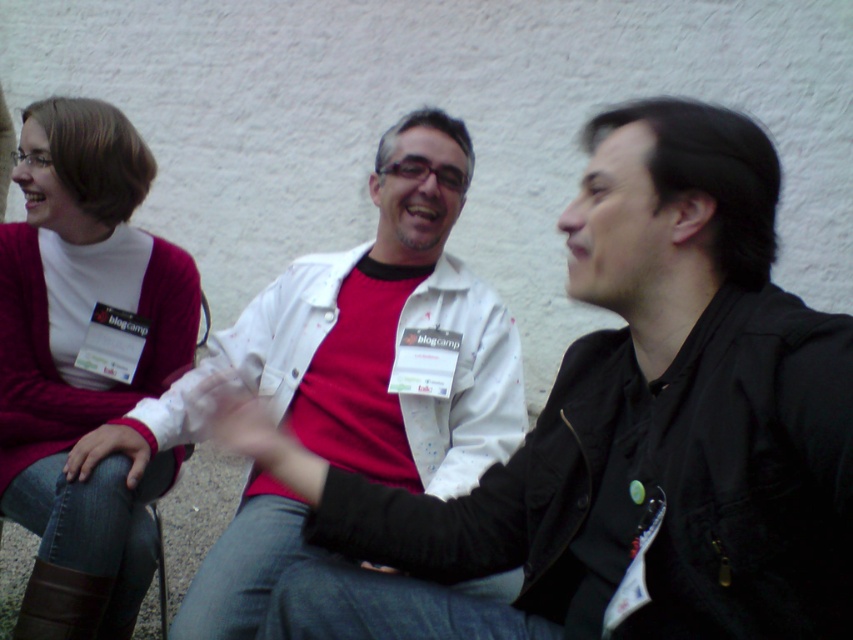
Is matte white jacket at center thinner than matte pink sweater at left?

No.

Is matte white jacket at center below matte pink sweater at left?

Yes.

Between point (660, 336) and point (183, 371), which one is positioned in front?

Positioned in front is point (660, 336).

The height and width of the screenshot is (640, 853). I want to click on matte white jacket at center, so click(x=621, y=433).

Can you confirm if matte white jacket at center is bigger than white matte jacket at center?

Incorrect, matte white jacket at center is not larger than white matte jacket at center.

Who is lower down, matte white jacket at center or white matte jacket at center?

matte white jacket at center is below.

Is point (258, 413) positioned before point (311, 284)?

Yes, it is.

Find the location of a particular element. matte white jacket at center is located at coordinates (621, 433).

What do you see at coordinates (383, 333) in the screenshot? I see `white matte jacket at center` at bounding box center [383, 333].

Between white matte jacket at center and matte pink sweater at left, which one appears on the right side from the viewer's perspective?

white matte jacket at center is more to the right.

Where is `white matte jacket at center`? The height and width of the screenshot is (640, 853). white matte jacket at center is located at coordinates (383, 333).